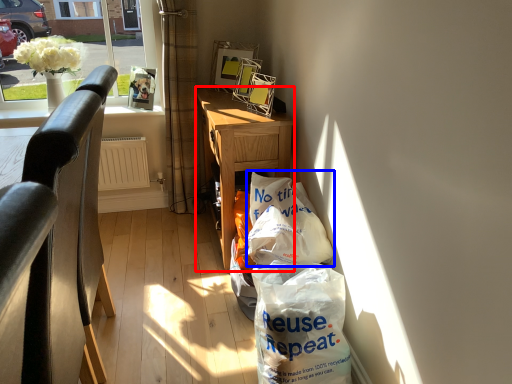
Question: Which point is closer to the camera, desk (highlighted by a red box) or grocery bag (highlighted by a blue box)?

Choices:
 (A) desk
 (B) grocery bag

Answer: (B)